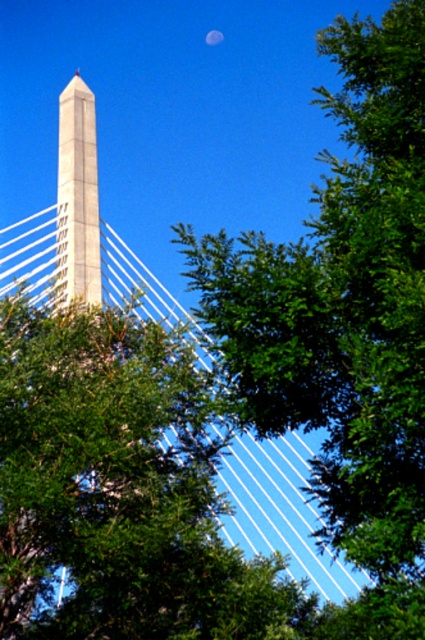
You are standing in front of the monument and want to take a photo that includes both the green leafy tree at upper right and the white concrete obelisk at center. Based on their positions, which object should you adjust your camera angle to include first?

The green leafy tree at upper right is positioned on the right side of the white concrete obelisk at center, so you should adjust your camera angle to include the green leafy tree at upper right first since it is to the right of the obelisk.

You are standing at the center of the monument and want to take a photo of the green leafy tree at upper right. According to the coordinates provided, in which direction should you point your camera to capture the tree?

The green leafy tree at upper right is located at coordinates point (345, 323). Since the monument is at the center, you should point your camera towards the upper right direction to capture the tree.